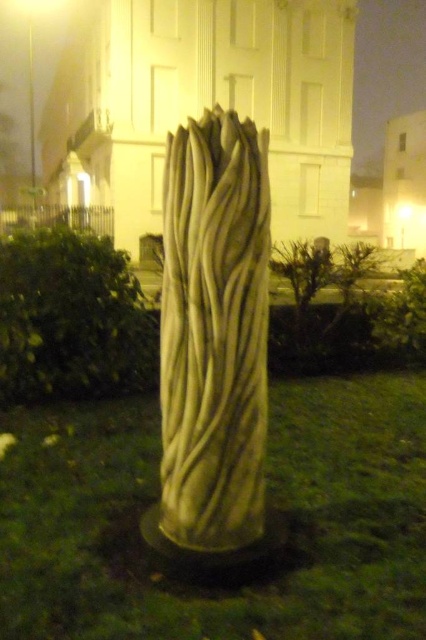
Between point (172, 372) and point (31, 100), which one is positioned in front?

Point (172, 372)

The width and height of the screenshot is (426, 640). In order to click on white marble column at center in this screenshot , I will do `click(213, 333)`.

Measure the distance from green grass at center to white textured pole at center.

green grass at center and white textured pole at center are 28.58 meters apart.

You are a GUI agent. You are given a task and a screenshot of the screen. Output one action in this format:
    pyautogui.click(x=<x>, y=<y>)
    Task: Click on the green grass at center
    This screenshot has width=426, height=640.
    Given the screenshot: What is the action you would take?
    pyautogui.click(x=276, y=500)

Which is behind, point (104, 580) or point (244, 324)?

Positioned behind is point (244, 324).

In the scene shown: Is green grass at center thinner than white marble column at center?

No, green grass at center is not thinner than white marble column at center.

Locate an element on the screen. The height and width of the screenshot is (640, 426). green grass at center is located at coordinates pos(276,500).

Where is `green grass at center`? This screenshot has height=640, width=426. green grass at center is located at coordinates (276, 500).